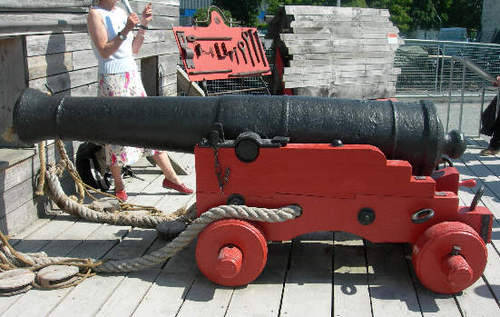
Locate an element on the screen. hand rail is located at coordinates (418, 42).